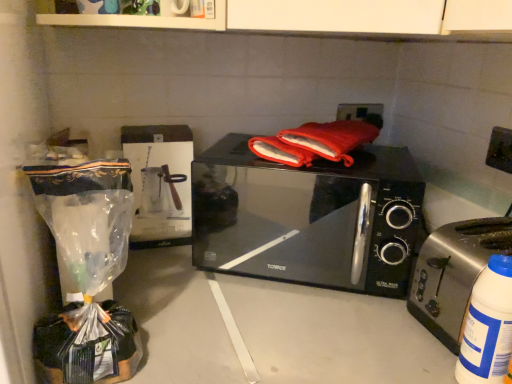
Question: Is black glossy microwave at center facing away from satin silver toaster at right?

Choices:
 (A) yes
 (B) no

Answer: (B)

Question: Can you see black glossy microwave at center touching satin silver toaster at right?

Choices:
 (A) no
 (B) yes

Answer: (A)

Question: Can you confirm if black glossy microwave at center is positioned to the left of satin silver toaster at right?

Choices:
 (A) yes
 (B) no

Answer: (A)

Question: Is black glossy microwave at center aimed at satin silver toaster at right?

Choices:
 (A) no
 (B) yes

Answer: (A)

Question: Is black glossy microwave at center in front of satin silver toaster at right?

Choices:
 (A) no
 (B) yes

Answer: (A)

Question: In terms of size, does satin silver toaster at right appear bigger or smaller than black glossy microwave at center?

Choices:
 (A) small
 (B) big

Answer: (A)

Question: Considering the positions of satin silver toaster at right and black glossy microwave at center in the image, is satin silver toaster at right taller or shorter than black glossy microwave at center?

Choices:
 (A) short
 (B) tall

Answer: (A)

Question: In the image, is satin silver toaster at right positioned in front of or behind black glossy microwave at center?

Choices:
 (A) front
 (B) behind

Answer: (A)

Question: Is point (450, 266) closer or farther from the camera than point (249, 178)?

Choices:
 (A) closer
 (B) farther

Answer: (A)

Question: Based on their positions, is satin silver toaster at right located to the left or right of white plastic bottle at lower right?

Choices:
 (A) left
 (B) right

Answer: (B)

Question: Is satin silver toaster at right in front of or behind white plastic bottle at lower right in the image?

Choices:
 (A) front
 (B) behind

Answer: (B)

Question: From the image's perspective, is satin silver toaster at right positioned above or below white plastic bottle at lower right?

Choices:
 (A) below
 (B) above

Answer: (B)

Question: Is satin silver toaster at right situated inside white plastic bottle at lower right or outside?

Choices:
 (A) inside
 (B) outside

Answer: (B)

Question: Does point (501, 276) appear closer or farther from the camera than point (437, 271)?

Choices:
 (A) closer
 (B) farther

Answer: (A)

Question: Is white plastic bottle at lower right spatially inside satin silver toaster at right, or outside of it?

Choices:
 (A) outside
 (B) inside

Answer: (A)